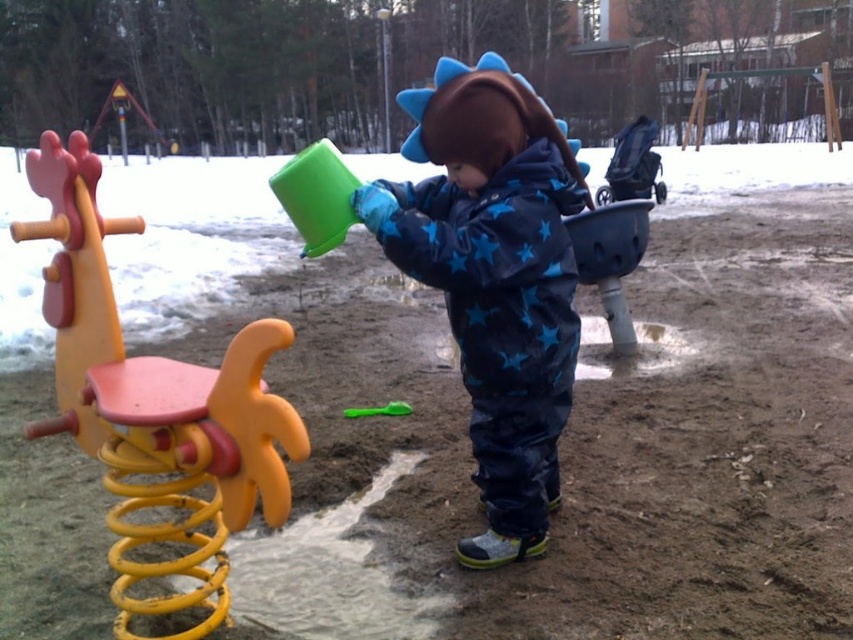
Question: Considering the real-world distances, which object is farthest from the yellow plastic spring at left?

Choices:
 (A) blue star-patterned snowsuit at center
 (B) green plastic spoon at center

Answer: (B)

Question: Is yellow plastic spring at left bigger than green plastic spoon at center?

Choices:
 (A) yes
 (B) no

Answer: (A)

Question: Does blue star-patterned snowsuit at center appear on the left side of green plastic spoon at center?

Choices:
 (A) no
 (B) yes

Answer: (A)

Question: Is blue star-patterned snowsuit at center positioned in front of yellow plastic spring at left?

Choices:
 (A) no
 (B) yes

Answer: (A)

Question: Estimate the real-world distances between objects in this image. Which object is closer to the blue star-patterned snowsuit at center?

Choices:
 (A) green plastic spoon at center
 (B) yellow plastic spring at left

Answer: (B)

Question: Among these points, which one is nearest to the camera?

Choices:
 (A) (538, 330)
 (B) (67, 186)

Answer: (B)